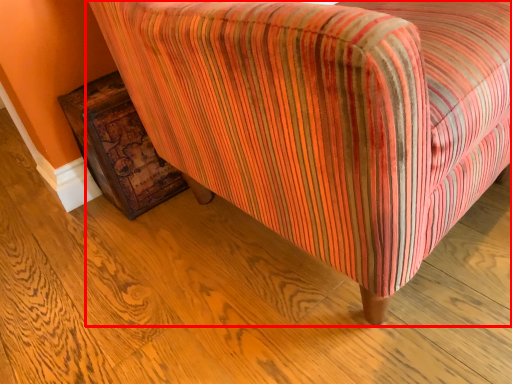
Question: From the image's perspective, what is the correct spatial positioning of chair (annotated by the red box) in reference to furniture?

Choices:
 (A) above
 (B) below

Answer: (A)